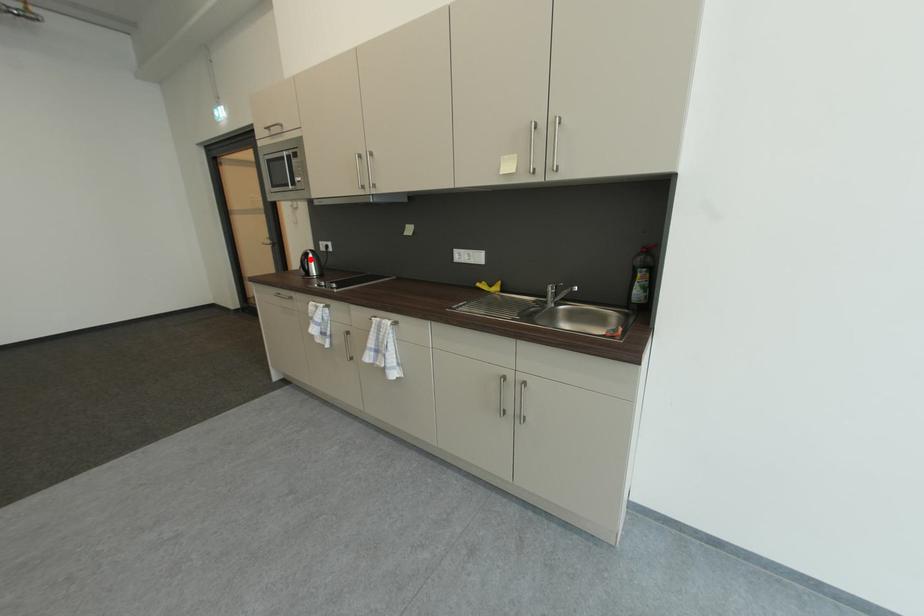
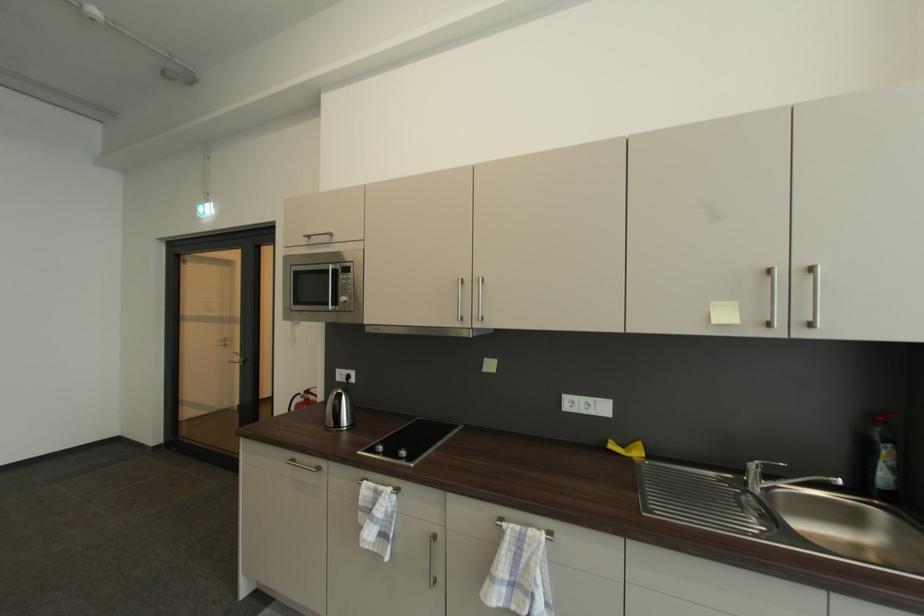
Question: I am providing you with two images of the same scene from different viewpoints. A red point is marked on the first image. At the location where the point appears in image 1, is it still visible in image 2?

Choices:
 (A) Yes
 (B) No

Answer: (A)